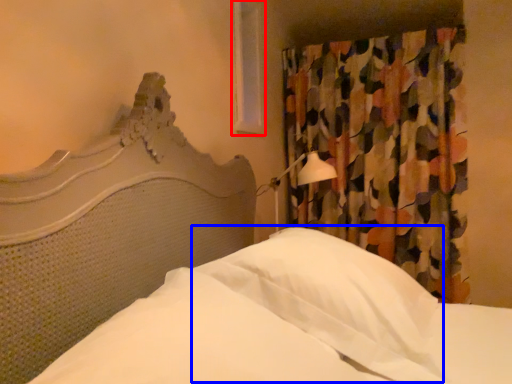
Question: Among these objects, which one is farthest to the camera, window (highlighted by a red box) or pillow (highlighted by a blue box)?

Choices:
 (A) window
 (B) pillow

Answer: (A)